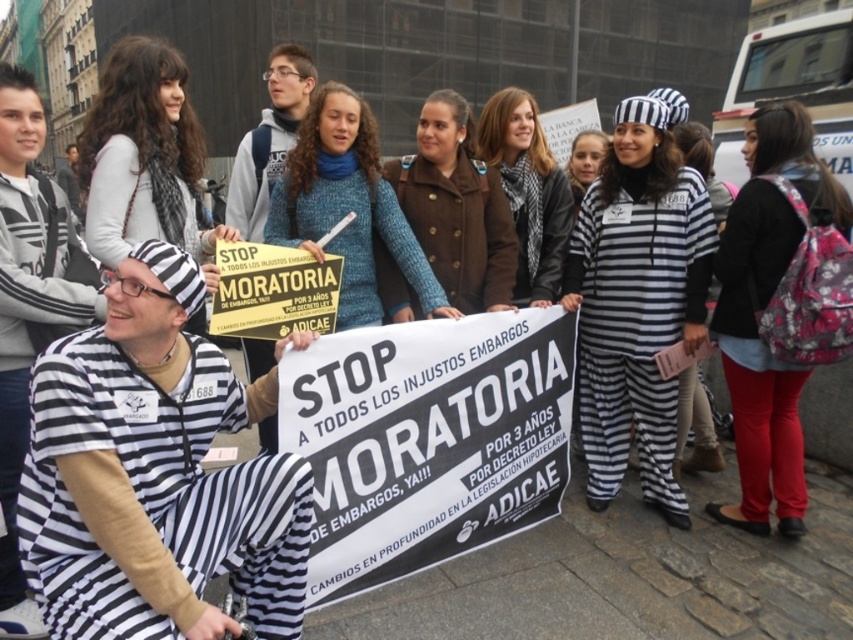
You are a photographer standing at the camera position. You want to take a photo of the sign held by the individual at point [312,220]. The sign says STOP MORATORIA DE E. Can you estimate how far you are from the sign?

The distance between the camera and the sign at point [312,220] is 4.10 meters, so you are 4.10 meters away from the sign.

What is the spatial relationship between the blue knitted sweater at center and the black and white striped prison uniform at center?

The blue knitted sweater at center is closer to the viewer than the black and white striped prison uniform at center.

You are observing a protest scene. There is a blue knitted sweater at center and a black and white striped prison uniform at center. Which object is positioned to the left?

The blue knitted sweater at center is positioned to the left of the black and white striped prison uniform at center.